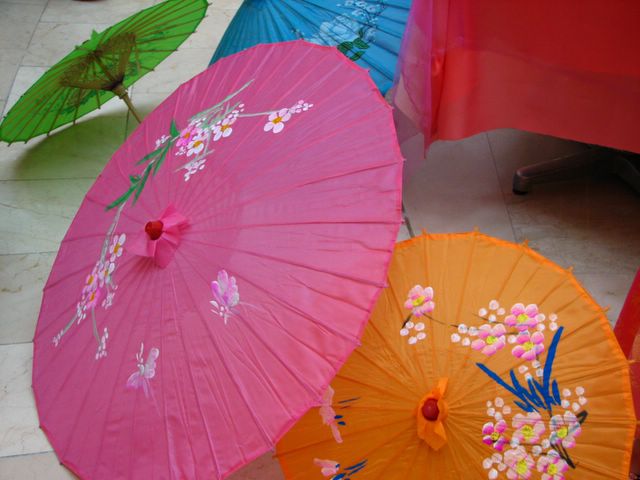
The width and height of the screenshot is (640, 480). In order to click on table cloth in this screenshot , I will do `click(548, 56)`.